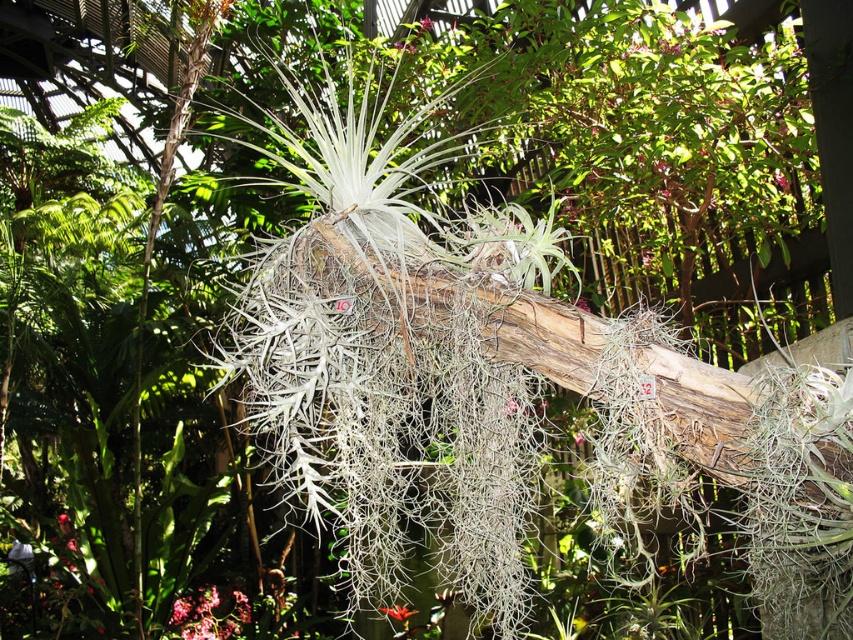
Can you confirm if pink matte flower at lower left is smaller than orange matte flower at center?

No, pink matte flower at lower left is not smaller than orange matte flower at center.

Can you confirm if pink matte flower at lower left is shorter than orange matte flower at center?

No, pink matte flower at lower left is not shorter than orange matte flower at center.

This screenshot has height=640, width=853. Describe the element at coordinates (207, 614) in the screenshot. I see `pink matte flower at lower left` at that location.

Image resolution: width=853 pixels, height=640 pixels. In order to click on pink matte flower at lower left in this screenshot , I will do (207, 614).